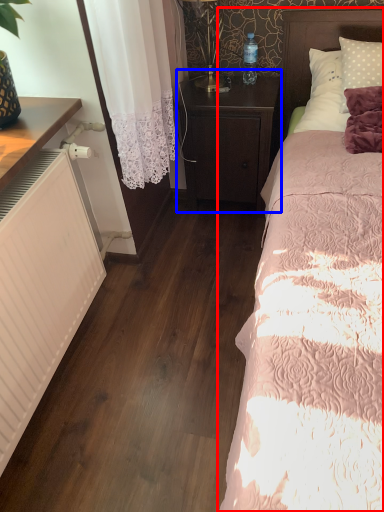
Question: Which of the following is the farthest to the observer, bed (highlighted by a red box) or nightstand (highlighted by a blue box)?

Choices:
 (A) bed
 (B) nightstand

Answer: (B)